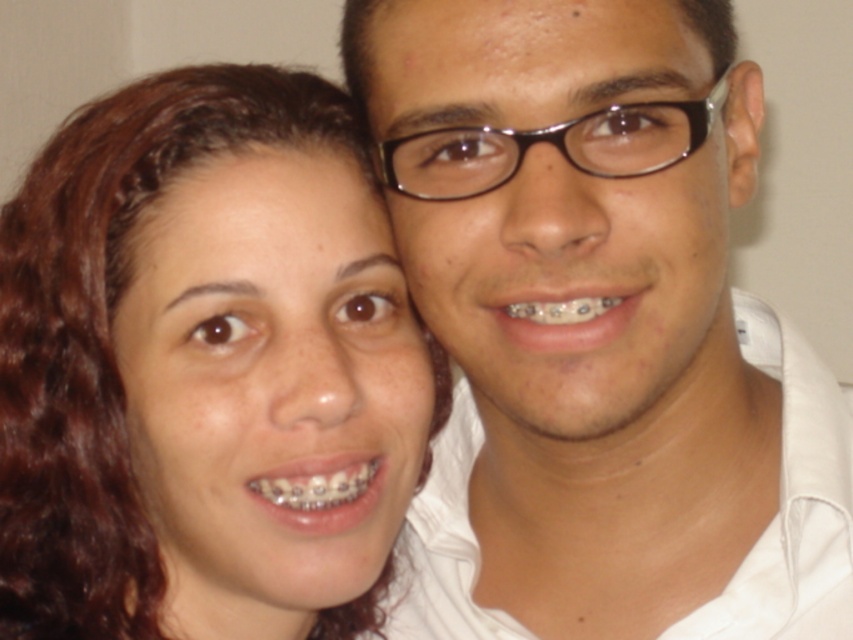
Can you confirm if matte skin at center is positioned above metallic braces at lower center?

Indeed, matte skin at center is positioned over metallic braces at lower center.

In the scene shown: Is matte skin at center positioned in front of metallic braces at lower center?

Yes, it is in front of metallic braces at lower center.

In order to click on matte skin at center in this screenshot , I will do `click(201, 364)`.

Between matte skin at center and metallic braces at center, which one is positioned lower?

matte skin at center

Is point (134, 204) farther from viewer compared to point (618, 289)?

Yes, it is behind point (618, 289).

The height and width of the screenshot is (640, 853). In order to click on matte skin at center in this screenshot , I will do `click(201, 364)`.

Is metallic braces at center closer to the viewer compared to metallic braces at lower center?

Yes, metallic braces at center is in front of metallic braces at lower center.

In order to click on metallic braces at center in this screenshot , I will do `click(567, 316)`.